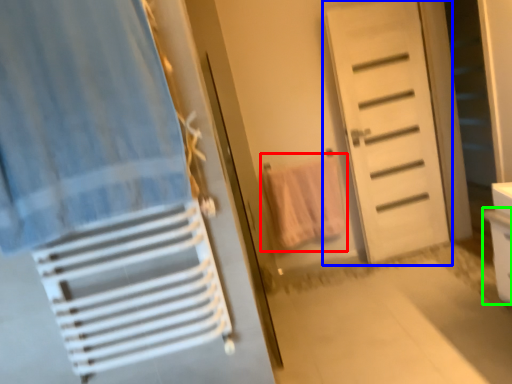
Question: Which object is positioned farthest from beach towel (highlighted by a red box)? Select from door (highlighted by a blue box) and drawer (highlighted by a green box).

Choices:
 (A) door
 (B) drawer

Answer: (B)